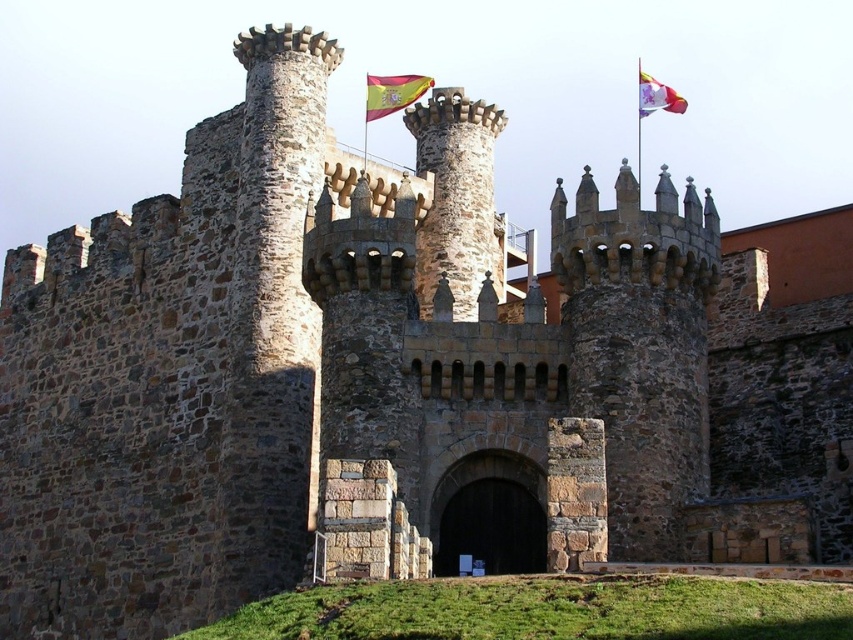
Is red fabric flag at upper center thinner than white fabric flag at upper right?

Correct, red fabric flag at upper center's width is less than white fabric flag at upper right's.

Is red fabric flag at upper center wider than white fabric flag at upper right?

Incorrect, red fabric flag at upper center's width does not surpass white fabric flag at upper right's.

Between point (387, 81) and point (675, 104), which one is positioned in front?

Point (675, 104) is in front.

Locate an element on the screen. red fabric flag at upper center is located at coordinates (392, 93).

Does brown wooden gate at center have a greater width compared to red fabric flag at upper center?

No.

Is brown wooden gate at center closer to the viewer compared to red fabric flag at upper center?

That is True.

You are a GUI agent. You are given a task and a screenshot of the screen. Output one action in this format:
    pyautogui.click(x=<x>, y=<y>)
    Task: Click on the brown wooden gate at center
    The height and width of the screenshot is (640, 853).
    Given the screenshot: What is the action you would take?
    pyautogui.click(x=489, y=515)

Which is in front, point (520, 472) or point (654, 83)?

Point (520, 472) is more forward.

Locate an element on the screen. brown wooden gate at center is located at coordinates (489, 515).